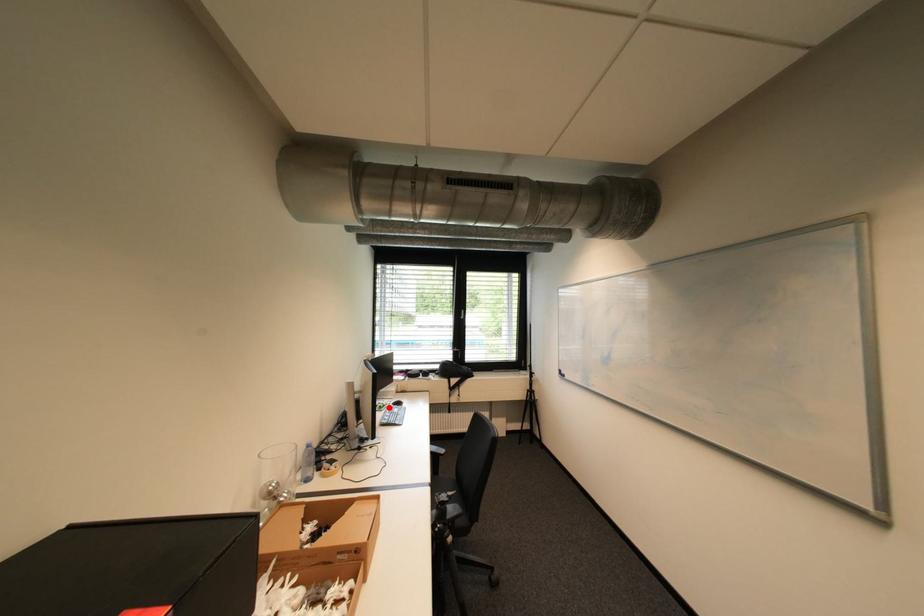
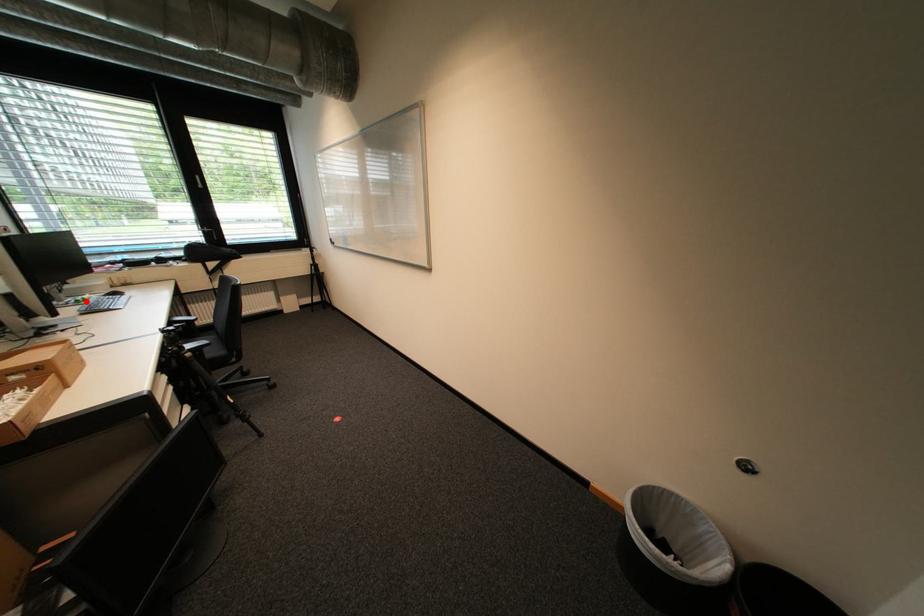
I am providing you with two images of the same scene from different viewpoints. A red point is marked on the first image and another point is marked on the second image. Does the point marked in image1 correspond to the same location as the one in image2?

Yes